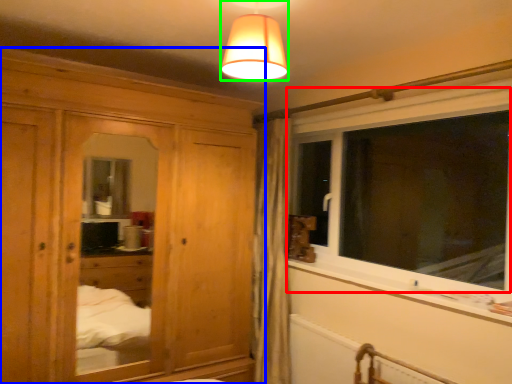
Question: Which is farther away from window (highlighted by a red box)? cabinetry (highlighted by a blue box) or lamp (highlighted by a green box)?

Choices:
 (A) cabinetry
 (B) lamp

Answer: (B)